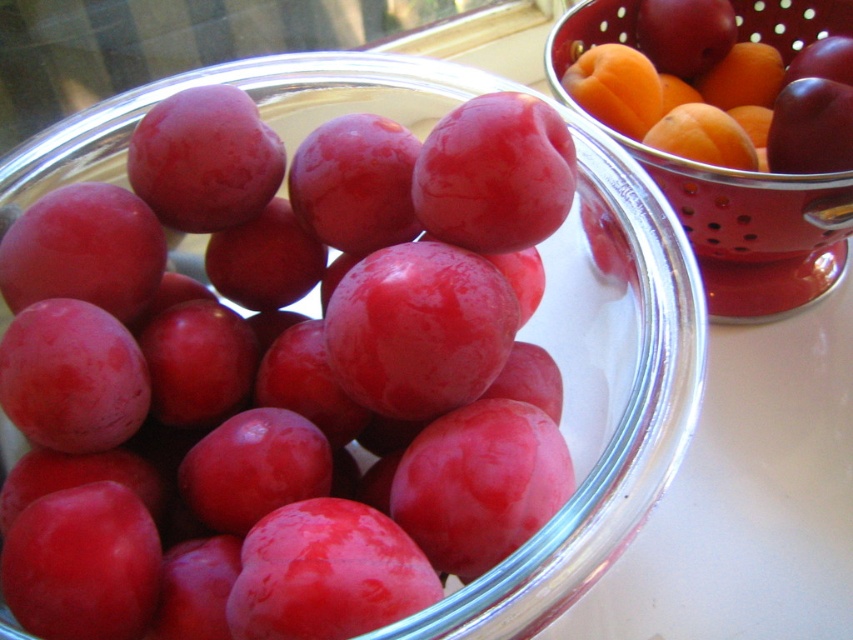
What do you see at coordinates (717, 76) in the screenshot? This screenshot has height=640, width=853. I see `glossy red plum at upper right` at bounding box center [717, 76].

Which is below, glossy red plum at upper right or orange matte at upper right?

Positioned lower is orange matte at upper right.

What do you see at coordinates (717, 76) in the screenshot?
I see `glossy red plum at upper right` at bounding box center [717, 76].

Locate an element on the screen. Image resolution: width=853 pixels, height=640 pixels. glossy red plum at upper right is located at coordinates (717, 76).